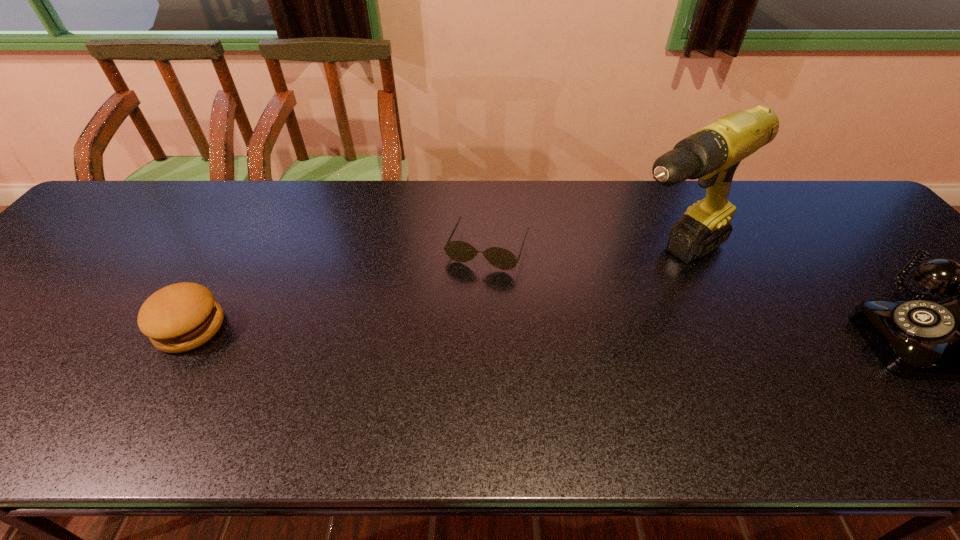
At what (x,y) coordinates should I click in order to perform the action: click on vacant area between the sunglasses and the drill. Please return your answer as a coordinate pair (x, y). The width and height of the screenshot is (960, 540). Looking at the image, I should click on (579, 253).

Where is `vacant point located between the third object from left to right and the sunglasses`? Image resolution: width=960 pixels, height=540 pixels. vacant point located between the third object from left to right and the sunglasses is located at coordinates (579, 253).

Locate an element on the screen. object that ranks as the third closest to the leftmost object is located at coordinates (917, 339).

Locate an element on the screen. object that stands as the second closest to the sunglasses is located at coordinates (180, 317).

Where is `vacant space that satisfies the following two spatial constraints: 1. on the front side of the third object from left to right; 2. on the right side of the sunglasses`? The width and height of the screenshot is (960, 540). vacant space that satisfies the following two spatial constraints: 1. on the front side of the third object from left to right; 2. on the right side of the sunglasses is located at coordinates (488, 259).